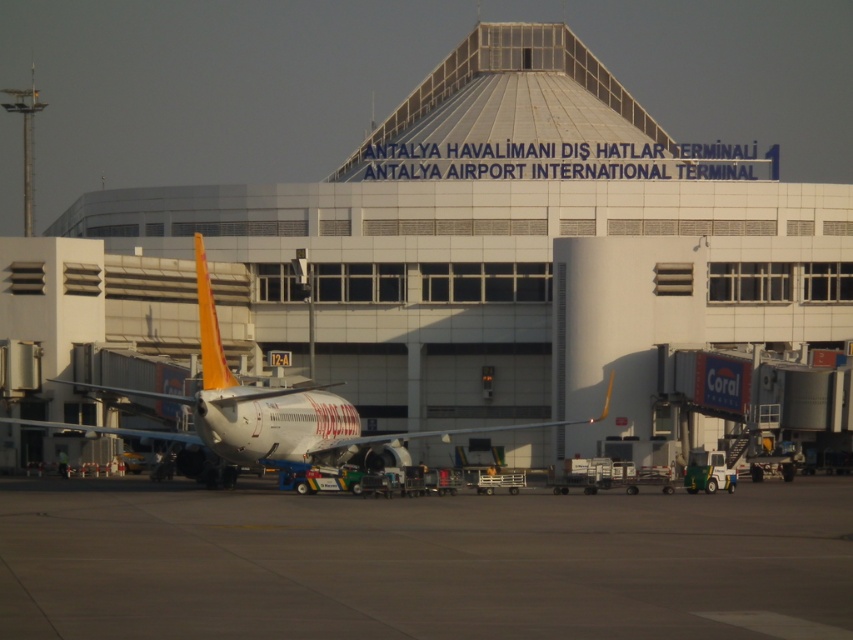
Question: Which of the following is the closest to the observer?

Choices:
 (A) (569, 422)
 (B) (64, 609)

Answer: (B)

Question: Which object appears closest to the camera in this image?

Choices:
 (A) white concrete building at center
 (B) gray concrete tarmac at lower center

Answer: (B)

Question: Does gray concrete tarmac at lower center have a larger size compared to white glossy airplane at center?

Choices:
 (A) yes
 (B) no

Answer: (B)

Question: Is white concrete building at center further to the viewer compared to white glossy airplane at center?

Choices:
 (A) yes
 (B) no

Answer: (A)

Question: Can you confirm if gray concrete tarmac at lower center is thinner than white glossy airplane at center?

Choices:
 (A) no
 (B) yes

Answer: (A)

Question: Estimate the real-world distances between objects in this image. Which object is farther from the gray concrete tarmac at lower center?

Choices:
 (A) white glossy airplane at center
 (B) white concrete building at center

Answer: (B)